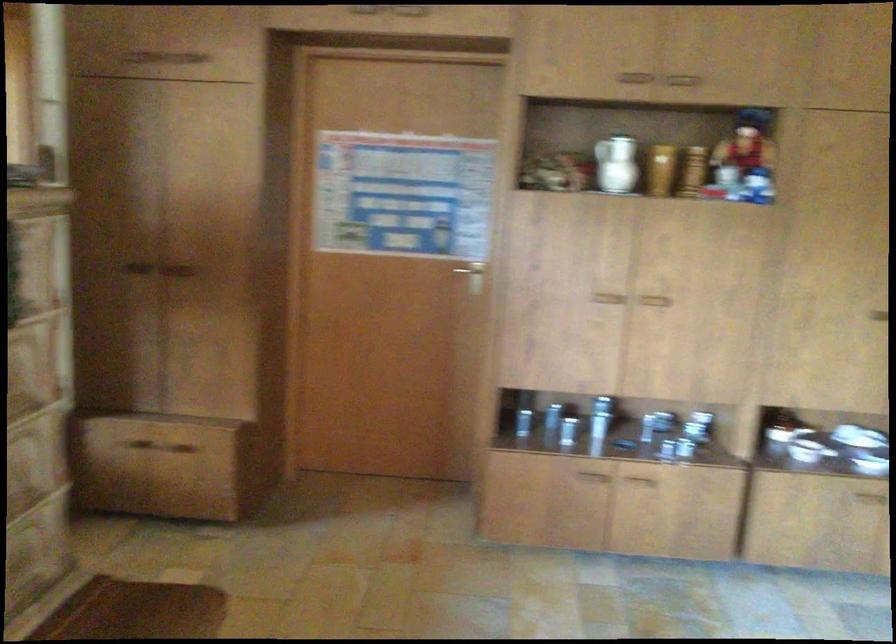
Locate an element on the screen. Image resolution: width=896 pixels, height=644 pixels. door handle is located at coordinates (636, 509).